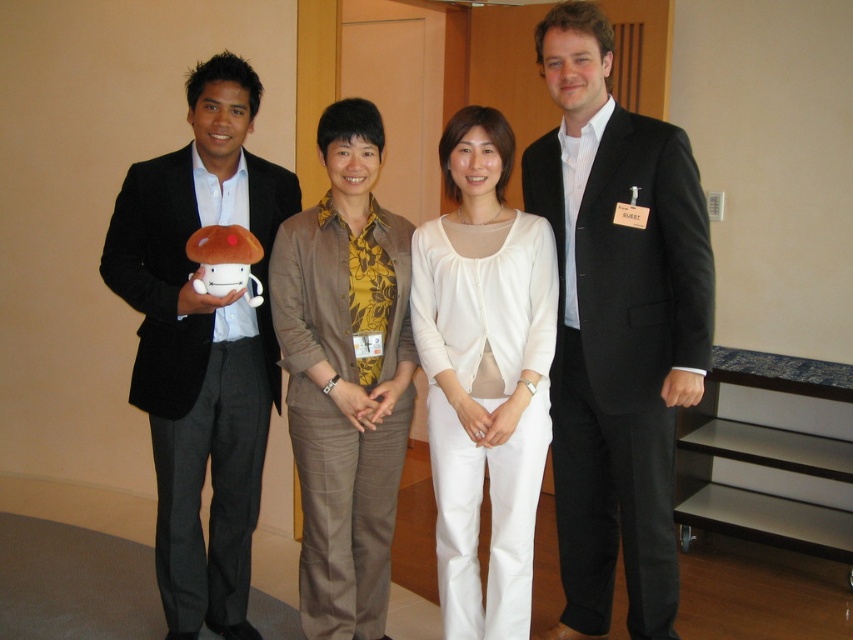
Can you confirm if black suit at center is positioned above matte black suit at left?

Yes.

Who is positioned more to the left, black suit at center or matte black suit at left?

matte black suit at left is more to the left.

Between point (566, 387) and point (218, 426), which one is positioned in front?

Point (566, 387)

Locate an element on the screen. Image resolution: width=853 pixels, height=640 pixels. black suit at center is located at coordinates (616, 326).

From the picture: Can you confirm if black suit at center is bigger than matte black suit at center?

Yes.

Which is behind, point (566, 44) or point (381, 154)?

The point (381, 154) is behind.

Image resolution: width=853 pixels, height=640 pixels. I want to click on black suit at center, so click(616, 326).

Is point (238, 563) behind point (535, 356)?

Yes, it is.

Identify the location of matte black suit at left. The image size is (853, 640). tap(202, 346).